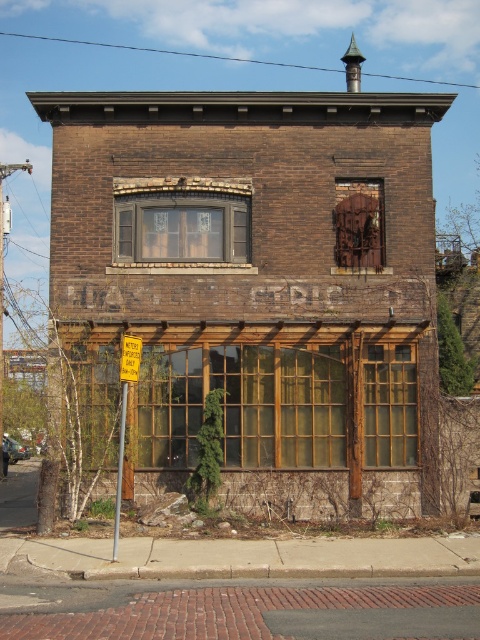
You are standing in front of the two story brick building. You see two points marked on the building. The first point is at coordinate point (x=371, y=346) and the second point is at coordinate point (x=348, y=212). Which point is closer to you?

Point (x=371, y=346) is closer to the viewer than point (x=348, y=212).

Please provide the 2D coordinates of the brown textured window at center in the image. The coordinates should be in the format of a point with two decimal places, such as point 0.34, 0.38.

The 2D coordinates of the brown textured window at center are point (182, 217).